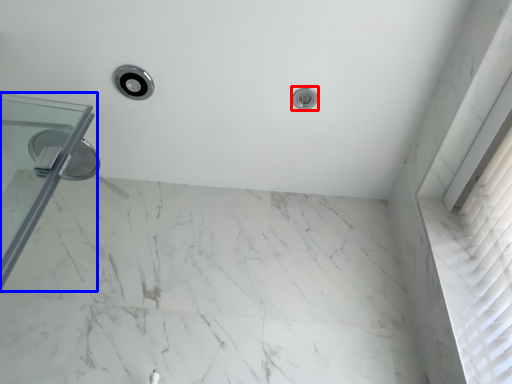
Question: Among these objects, which one is nearest to the camera, shower (highlighted by a red box) or glass door (highlighted by a blue box)?

Choices:
 (A) shower
 (B) glass door

Answer: (B)